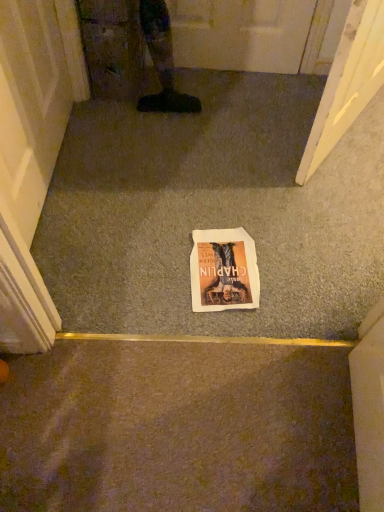
Where is `blank space situated above white paper comic book at center (from a real-world perspective)`? This screenshot has height=512, width=384. blank space situated above white paper comic book at center (from a real-world perspective) is located at coordinates (216, 262).